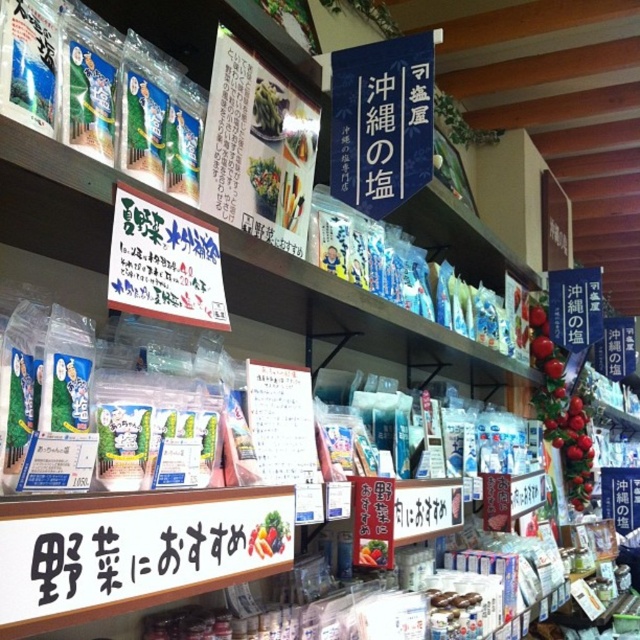
Can you confirm if blue paper sign at upper center is positioned below black plastic sign at lower center?

No.

Which is in front, point (428, 173) or point (140, 580)?

Point (140, 580) is more forward.

Identify the location of blue paper sign at upper center. Image resolution: width=640 pixels, height=640 pixels. (381, 122).